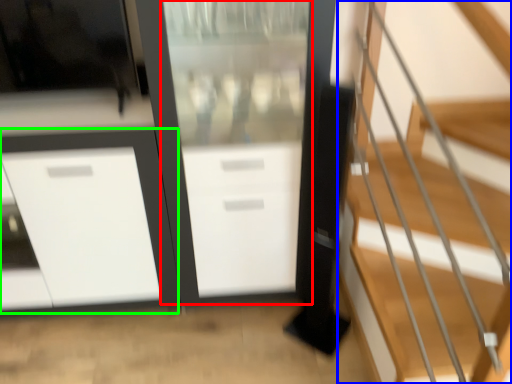
Question: Estimate the real-world distances between objects in this image. Which object is farther from screen door (highlighted by a red box), stairs (highlighted by a blue box) or cabinetry (highlighted by a green box)?

Choices:
 (A) stairs
 (B) cabinetry

Answer: (A)